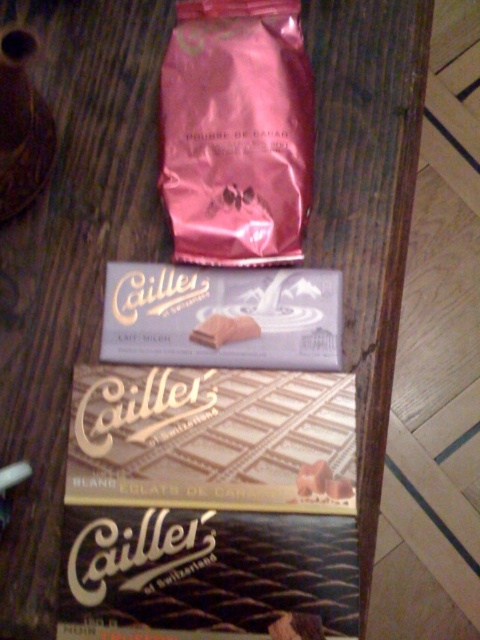
Question: Can you confirm if pink metallic bag at upper center is positioned below white cardboard chocolate bar at center?

Choices:
 (A) no
 (B) yes

Answer: (A)

Question: Is white cardboard chocolate bar at center wider than white matte chocolate bar at center?

Choices:
 (A) no
 (B) yes

Answer: (B)

Question: Considering the real-world distances, which object is farthest from the white cardboard chocolate bar at center?

Choices:
 (A) pink metallic bag at upper center
 (B) white matte chocolate bar at center
 (C) gold foil chocolate bar at center

Answer: (A)

Question: Which object is farther from the camera taking this photo?

Choices:
 (A) gold foil chocolate bar at center
 (B) white cardboard chocolate bar at center
 (C) pink metallic bag at upper center

Answer: (B)

Question: Can you confirm if gold foil chocolate bar at center is bigger than white matte chocolate bar at center?

Choices:
 (A) no
 (B) yes

Answer: (B)

Question: Estimate the real-world distances between objects in this image. Which object is closer to the gold foil chocolate bar at center?

Choices:
 (A) pink metallic bag at upper center
 (B) white matte chocolate bar at center
 (C) white cardboard chocolate bar at center

Answer: (C)